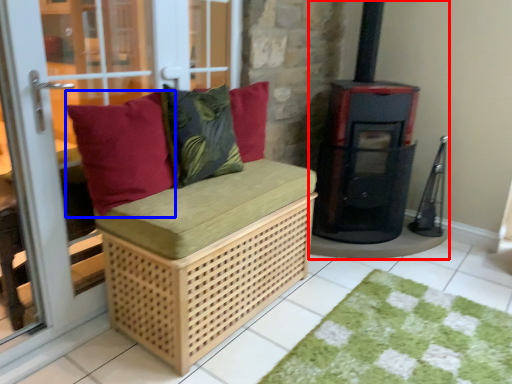
Question: Among these objects, which one is farthest to the camera, wood burning stove (highlighted by a red box) or pillow (highlighted by a blue box)?

Choices:
 (A) wood burning stove
 (B) pillow

Answer: (A)